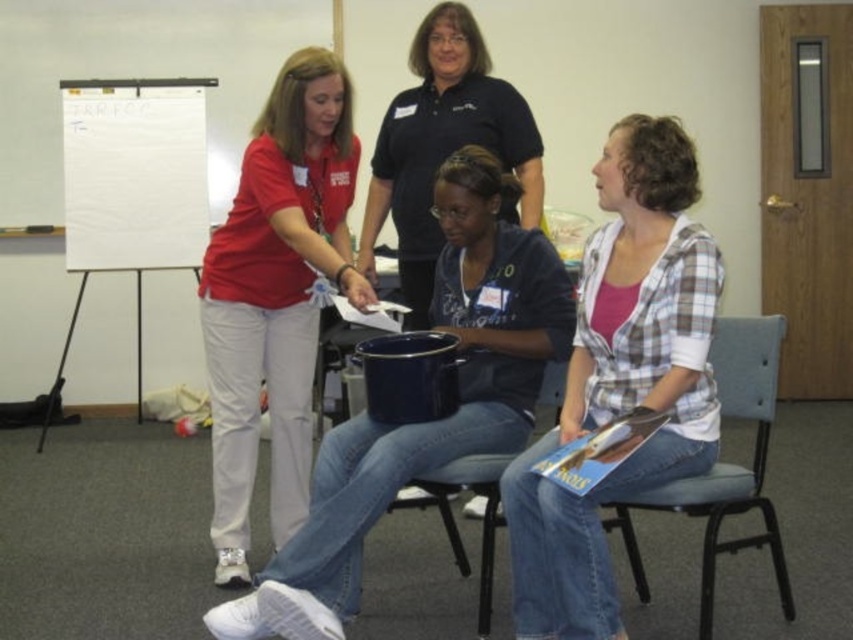
Does point (102, 211) come closer to viewer compared to point (428, 244)?

That is False.

Is the position of white paperboard at upper left more distant than that of matte black shirt at center?

Yes, it is behind matte black shirt at center.

Between point (80, 84) and point (438, 35), which one is positioned behind?

Positioned behind is point (80, 84).

Find the location of `white paperboard at upper left`. white paperboard at upper left is located at coordinates (134, 173).

The height and width of the screenshot is (640, 853). What do you see at coordinates (426, 420) in the screenshot?
I see `matte blue bucket at center` at bounding box center [426, 420].

Between matte blue bucket at center and blue fabric chair at right, which one has more height?

matte blue bucket at center is taller.

Is point (459, 396) closer to camera compared to point (730, 477)?

No.

At what (x,y) coordinates should I click in order to perform the action: click on matte blue bucket at center. Please return your answer as a coordinate pair (x, y). This screenshot has width=853, height=640. Looking at the image, I should click on (426, 420).

Does matte black shirt at center have a lesser height compared to blue fabric chair at right?

In fact, matte black shirt at center may be taller than blue fabric chair at right.

Looking at this image, can you confirm if matte black shirt at center is wider than blue fabric chair at right?

Yes.

Does point (384, 120) lie in front of point (782, 323)?

No.

You are a GUI agent. You are given a task and a screenshot of the screen. Output one action in this format:
    pyautogui.click(x=<x>, y=<y>)
    Task: Click on the matte black shirt at center
    This screenshot has height=640, width=853.
    Given the screenshot: What is the action you would take?
    pyautogui.click(x=444, y=147)